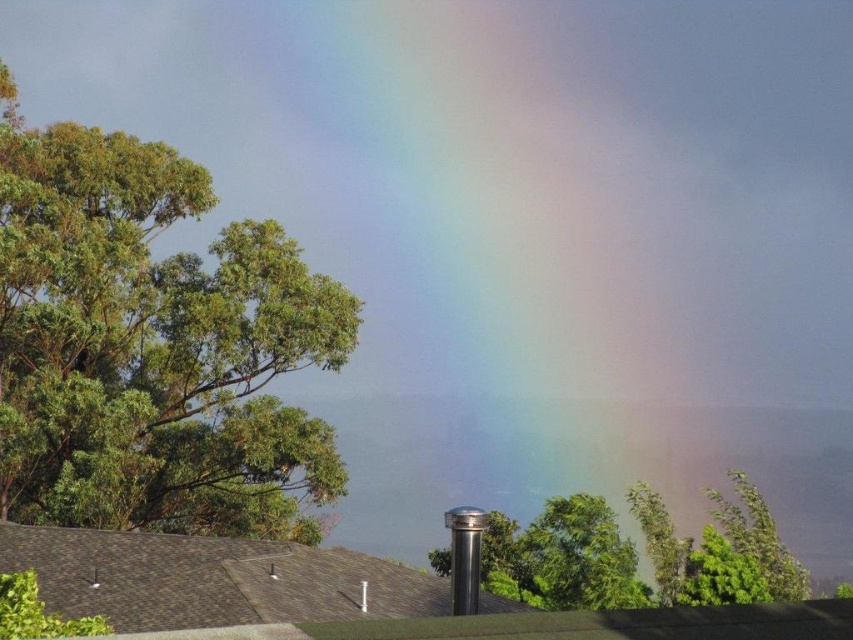
Question: Is green leafy tree at upper left smaller than green leafy tree at center?

Choices:
 (A) yes
 (B) no

Answer: (A)

Question: Which point appears closest to the camera in this image?

Choices:
 (A) (338, 477)
 (B) (563, 584)

Answer: (B)

Question: Can you confirm if green leafy tree at upper left is wider than green leafy tree at center?

Choices:
 (A) yes
 (B) no

Answer: (B)

Question: Considering the relative positions of green leafy tree at upper left and green leafy tree at center in the image provided, where is green leafy tree at upper left located with respect to green leafy tree at center?

Choices:
 (A) below
 (B) above

Answer: (B)

Question: Which point is closer to the camera?

Choices:
 (A) (248, 506)
 (B) (761, 531)

Answer: (B)

Question: Which of the following is the farthest from the observer?

Choices:
 (A) (36, 337)
 (B) (740, 576)

Answer: (B)